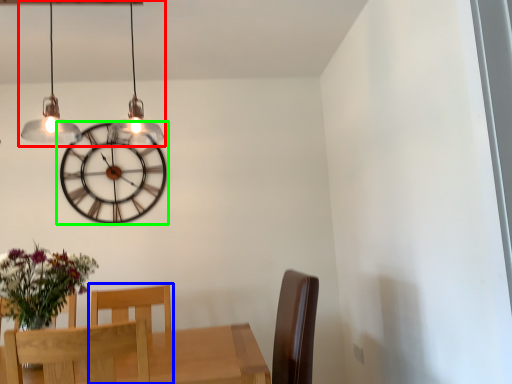
Question: Which object is positioned farthest from lamp (highlighted by a red box)? Select from chair (highlighted by a blue box) and wall clock (highlighted by a green box).

Choices:
 (A) chair
 (B) wall clock

Answer: (A)